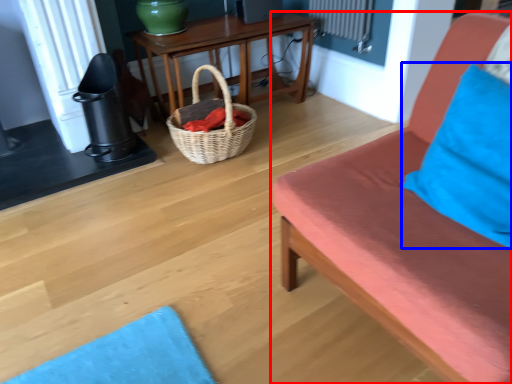
Question: Among these objects, which one is farthest to the camera, studio couch (highlighted by a red box) or pillow (highlighted by a blue box)?

Choices:
 (A) studio couch
 (B) pillow

Answer: (B)